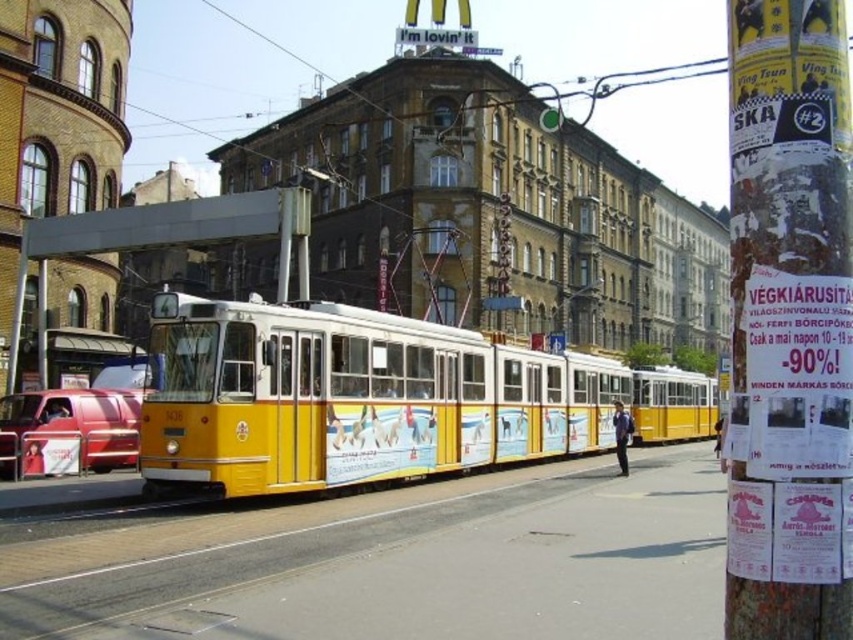
Question: Can you confirm if paper posters at right is smaller than metallic red van at left?

Choices:
 (A) yes
 (B) no

Answer: (B)

Question: Can you confirm if paper posters at right is smaller than metallic red van at left?

Choices:
 (A) yes
 (B) no

Answer: (B)

Question: Is paper posters at right wider than metallic red van at left?

Choices:
 (A) yes
 (B) no

Answer: (A)

Question: Which object is closer to the camera taking this photo?

Choices:
 (A) paper posters at right
 (B) metallic red van at left

Answer: (A)

Question: Which object appears closest to the camera in this image?

Choices:
 (A) paper posters at right
 (B) metallic red van at left

Answer: (A)